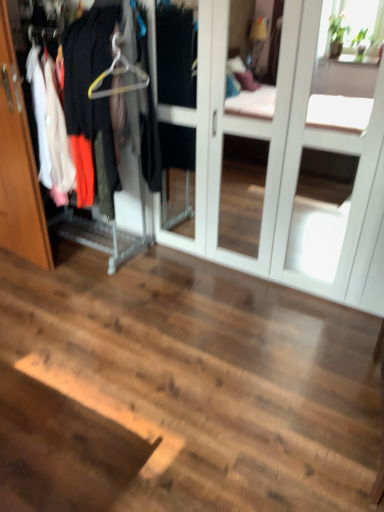
Question: Considering the relative positions of yellow plastic hanger at upper left and white glossy screen door at center in the image provided, is yellow plastic hanger at upper left to the right of white glossy screen door at center from the viewer's perspective?

Choices:
 (A) yes
 (B) no

Answer: (B)

Question: Can you confirm if yellow plastic hanger at upper left is smaller than white glossy screen door at center?

Choices:
 (A) no
 (B) yes

Answer: (B)

Question: Is yellow plastic hanger at upper left touching white glossy screen door at center?

Choices:
 (A) yes
 (B) no

Answer: (B)

Question: Considering the relative sizes of yellow plastic hanger at upper left and white glossy screen door at center in the image provided, is yellow plastic hanger at upper left wider than white glossy screen door at center?

Choices:
 (A) no
 (B) yes

Answer: (A)

Question: Can you confirm if yellow plastic hanger at upper left is taller than white glossy screen door at center?

Choices:
 (A) no
 (B) yes

Answer: (A)

Question: Is white glossy screen door at center bigger or smaller than wooden door at left?

Choices:
 (A) big
 (B) small

Answer: (A)

Question: Considering their positions, is white glossy screen door at center located in front of or behind wooden door at left?

Choices:
 (A) front
 (B) behind

Answer: (A)

Question: Is point (337, 11) positioned closer to the camera than point (4, 101)?

Choices:
 (A) closer
 (B) farther

Answer: (B)

Question: In the image, is white glossy screen door at center on the left side or the right side of wooden door at left?

Choices:
 (A) left
 (B) right

Answer: (B)

Question: From a real-world perspective, is yellow plastic hanger at upper left positioned above or below metallic hanger at left?

Choices:
 (A) below
 (B) above

Answer: (B)

Question: Choose the correct answer: Is yellow plastic hanger at upper left inside metallic hanger at left or outside it?

Choices:
 (A) outside
 (B) inside

Answer: (B)

Question: Considering the positions of point (97, 89) and point (21, 252), is point (97, 89) closer or farther from the camera than point (21, 252)?

Choices:
 (A) closer
 (B) farther

Answer: (A)

Question: Looking at the image, does yellow plastic hanger at upper left seem bigger or smaller compared to metallic hanger at left?

Choices:
 (A) small
 (B) big

Answer: (A)

Question: In terms of width, does white glossy screen door at center look wider or thinner when compared to metallic hanger at left?

Choices:
 (A) wide
 (B) thin

Answer: (A)

Question: Considering the positions of white glossy screen door at center and metallic hanger at left in the image, is white glossy screen door at center bigger or smaller than metallic hanger at left?

Choices:
 (A) big
 (B) small

Answer: (A)